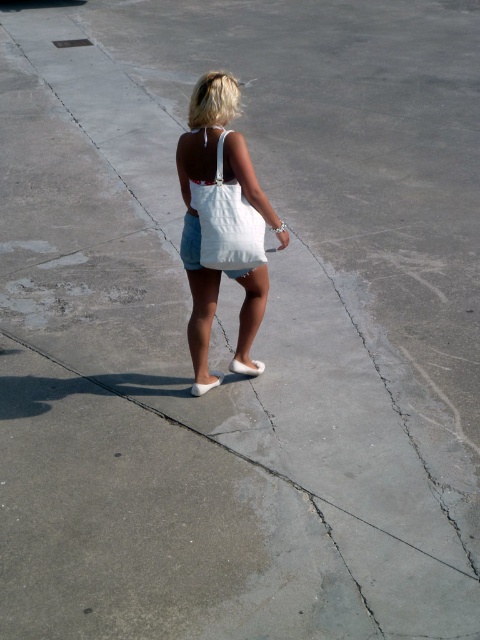
Question: Which point is closer to the camera?

Choices:
 (A) (264, 365)
 (B) (195, 394)

Answer: (B)

Question: Based on their relative distances, which object is farther from the white suede sandal at center?

Choices:
 (A) white suede sandal at lower center
 (B) white canvas tote at upper center
 (C) white canvas bag at center

Answer: (B)

Question: Is white suede sandal at center positioned behind white suede sandal at lower center?

Choices:
 (A) yes
 (B) no

Answer: (A)

Question: Considering the relative positions of white canvas bag at center and white suede sandal at center in the image provided, where is white canvas bag at center located with respect to white suede sandal at center?

Choices:
 (A) above
 (B) below

Answer: (A)

Question: Which of the following is the closest to the observer?

Choices:
 (A) white suede sandal at lower center
 (B) white suede sandal at center
 (C) white canvas tote at upper center

Answer: (C)

Question: Can you confirm if white canvas bag at center is positioned above white canvas tote at upper center?

Choices:
 (A) no
 (B) yes

Answer: (A)